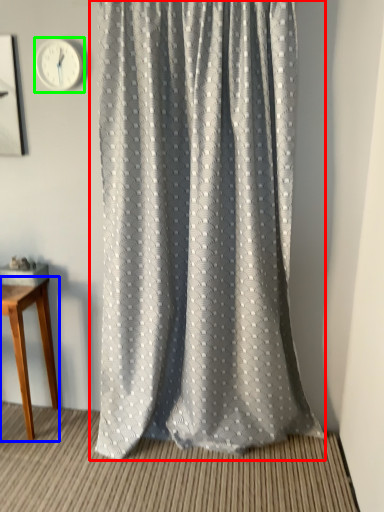
Question: Which object is the closest to the curtain (highlighted by a red box)? Choose among these: table (highlighted by a blue box) or clock (highlighted by a green box).

Choices:
 (A) table
 (B) clock

Answer: (A)